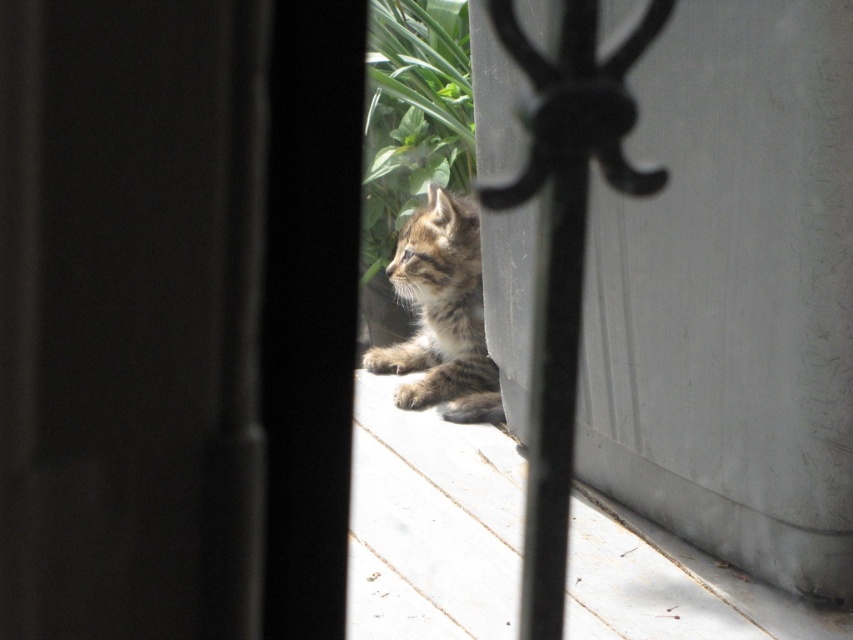
Can you confirm if white wood at lower center is bigger than green leafy plant at upper center?

Yes.

At what (x,y) coordinates should I click in order to perform the action: click on white wood at lower center. Please return your answer as a coordinate pair (x, y). This screenshot has height=640, width=853. Looking at the image, I should click on (436, 515).

Which is behind, point (354, 476) or point (386, 131)?

Positioned behind is point (386, 131).

The width and height of the screenshot is (853, 640). I want to click on white wood at lower center, so click(x=436, y=515).

Does point (283, 474) come farther from viewer compared to point (424, 260)?

No.

Measure the distance between black matte screen door at center and camera.

black matte screen door at center is 16.46 inches from camera.

This screenshot has height=640, width=853. What are the coordinates of `black matte screen door at center` in the screenshot? It's located at (177, 316).

Does black matte screen door at center have a larger size compared to white wood at lower center?

Incorrect, black matte screen door at center is not larger than white wood at lower center.

Is black matte screen door at center above white wood at lower center?

Yes, black matte screen door at center is above white wood at lower center.

This screenshot has height=640, width=853. I want to click on black matte screen door at center, so click(x=177, y=316).